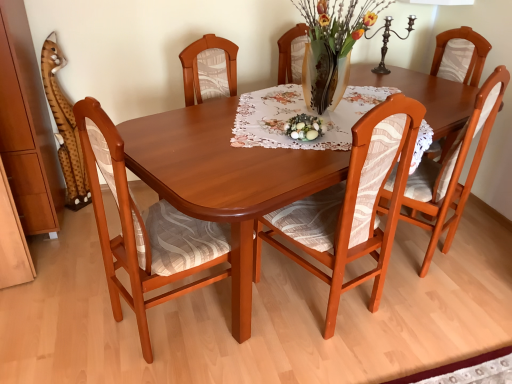
Question: From the image's perspective, relative to matte wood chair at center, the 2th chair from the right, is matte wood chair at center, arranged as the first chair when viewed from the right, above or below?

Choices:
 (A) above
 (B) below

Answer: (A)

Question: Is matte wood chair at center, acting as the third chair starting from the left, taller or shorter than matte wood chair at center, the 2th chair from the right?

Choices:
 (A) short
 (B) tall

Answer: (A)

Question: Based on their relative distances, which object is nearer to the matte green glass bowl at center?

Choices:
 (A) wooden chair at left, marked as the first chair in a left-to-right arrangement
 (B) shiny wood table at center
 (C) matte wood chair at center, the 2th chair from the right
 (D) matte wood chair at center, arranged as the first chair when viewed from the right

Answer: (B)

Question: Estimate the real-world distances between objects in this image. Which object is farther from the matte green glass bowl at center?

Choices:
 (A) shiny wood table at center
 (B) wooden chair at left, marked as the first chair in a left-to-right arrangement
 (C) matte wood chair at center, acting as the third chair starting from the left
 (D) matte wood chair at center, the 2th chair from the right

Answer: (C)